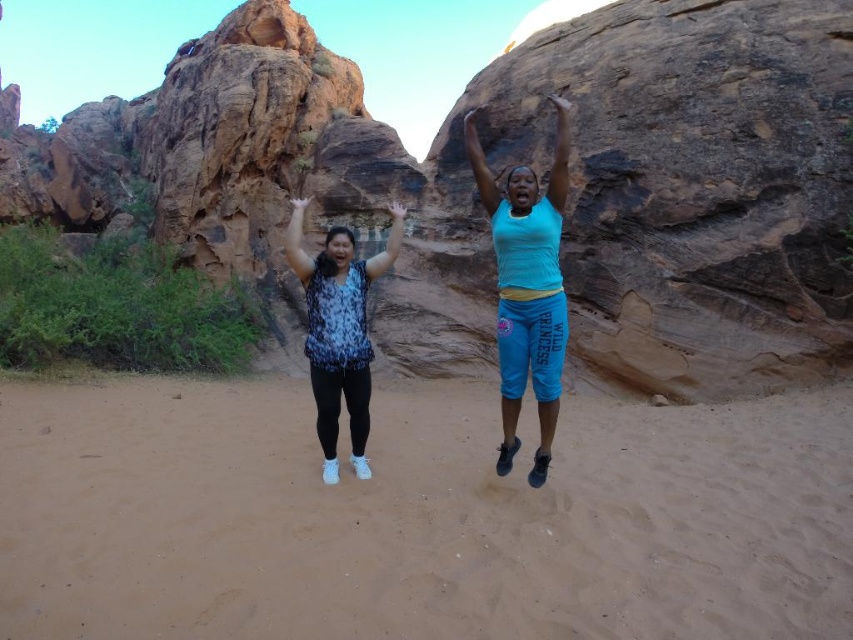
Question: Can you confirm if blue fabric arm at upper center is positioned above white matte arm at center?

Choices:
 (A) no
 (B) yes

Answer: (B)

Question: Which point appears farthest from the camera in this image?

Choices:
 (A) (364, 348)
 (B) (392, 211)

Answer: (B)

Question: Which object is positioned farthest from the blue fabric arm at center?

Choices:
 (A) brown sandy ground at center
 (B) blue fabric arm at upper center

Answer: (A)

Question: Among these objects, which one is nearest to the camera?

Choices:
 (A) matte black arm at center
 (B) blue fabric arm at center

Answer: (B)

Question: Can you confirm if brown sandy ground at center is positioned to the left of blue fabric arm at upper center?

Choices:
 (A) yes
 (B) no

Answer: (A)

Question: Is blue fabric arm at upper center positioned at the back of matte black arm at center?

Choices:
 (A) yes
 (B) no

Answer: (B)